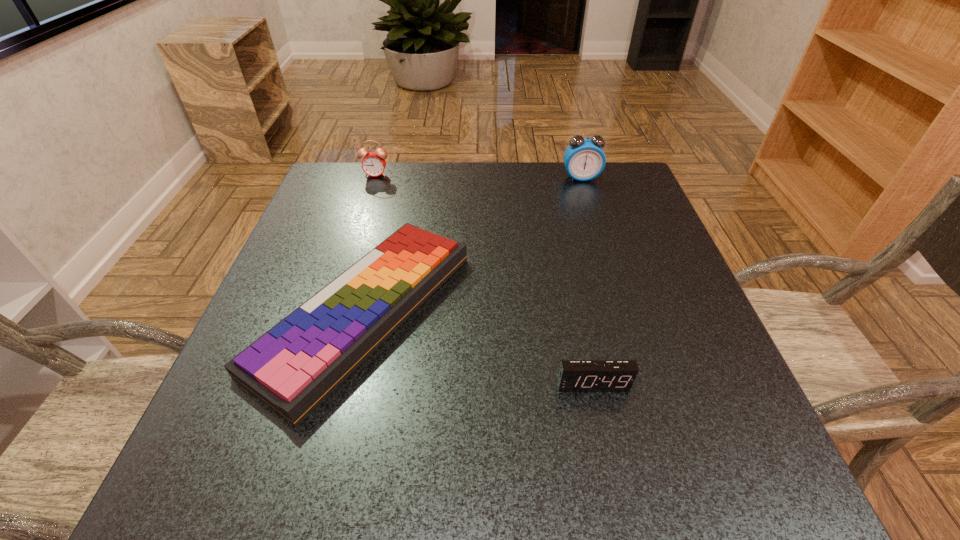
At what (x,y) coordinates should I click in order to perform the action: click on free spot between the second shortest alarm clock and the computer keyboard. Please return your answer as a coordinate pair (x, y). Image resolution: width=960 pixels, height=540 pixels. Looking at the image, I should click on (370, 243).

Select which object is the second closest to the third shortest object. Please provide its 2D coordinates. Your answer should be formatted as a tuple, i.e. [(x, y)], where the tuple contains the x and y coordinates of a point satisfying the conditions above.

[(584, 159)]

Locate an element on the screen. Image resolution: width=960 pixels, height=540 pixels. object that is the second closest one to the tallest object is located at coordinates (373, 164).

This screenshot has height=540, width=960. I want to click on alarm clock that stands as the closest to the tallest alarm clock, so click(373, 164).

Image resolution: width=960 pixels, height=540 pixels. Find the location of `alarm clock that can be found as the closest to the nearest alarm clock`. alarm clock that can be found as the closest to the nearest alarm clock is located at coordinates tap(584, 159).

Find the location of a particular element. The image size is (960, 540). vacant space that satisfies the following two spatial constraints: 1. on the clock face of the leftmost alarm clock; 2. on the right side of the computer keyboard is located at coordinates click(x=331, y=312).

The image size is (960, 540). I want to click on free location that satisfies the following two spatial constraints: 1. on the clock face of the second tallest alarm clock; 2. on the left side of the computer keyboard, so click(x=331, y=312).

The height and width of the screenshot is (540, 960). Find the location of `free spot that satisfies the following two spatial constraints: 1. on the clock face of the computer keyboard; 2. on the left side of the second tallest object`. free spot that satisfies the following two spatial constraints: 1. on the clock face of the computer keyboard; 2. on the left side of the second tallest object is located at coordinates (331, 312).